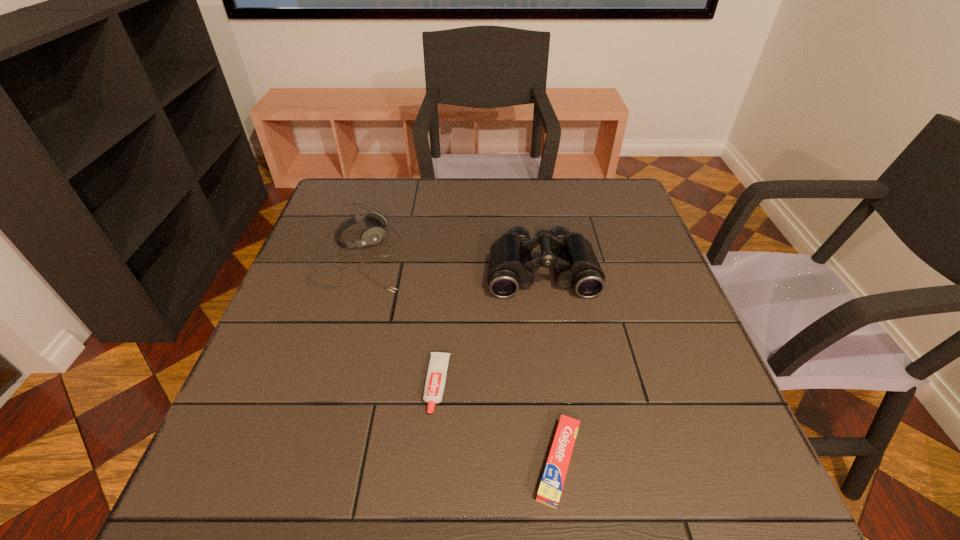
In the image, there is a desktop. Where is `vacant space at the near right corner`? vacant space at the near right corner is located at coordinates (681, 482).

Identify the location of vacant area that lies between the nearer toothpaste and the tallest object. This screenshot has height=540, width=960. (550, 366).

This screenshot has width=960, height=540. I want to click on free space that is in between the nearer toothpaste and the tallest object, so click(550, 366).

Find the location of a particular element. This screenshot has width=960, height=540. vacant space that is in between the headset and the nearer toothpaste is located at coordinates pyautogui.click(x=459, y=358).

Image resolution: width=960 pixels, height=540 pixels. In order to click on vacant area between the third shortest object and the binoculars in this screenshot , I will do [x=450, y=262].

Find the location of `vacant space that is in between the second object from left to right and the tallest object`. vacant space that is in between the second object from left to right and the tallest object is located at coordinates (490, 327).

I want to click on vacant space that is in between the nearer toothpaste and the farther toothpaste, so click(498, 423).

Locate an element on the screen. The height and width of the screenshot is (540, 960). free space between the tallest object and the headset is located at coordinates (450, 262).

Identify the location of empty space between the left toothpaste and the tallest object. This screenshot has width=960, height=540. (490, 327).

The image size is (960, 540). I want to click on unoccupied area between the third shortest object and the second nearest object, so point(398,319).